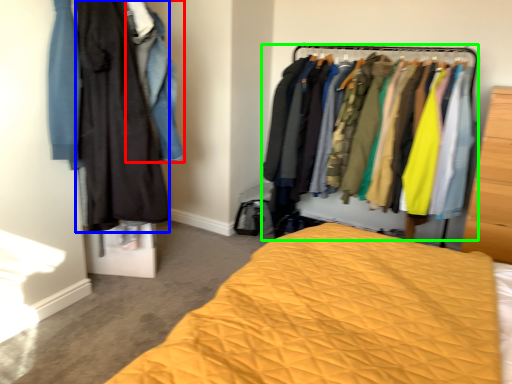
Question: Which is farther away from clothing (highlighted by a red box)? clothing (highlighted by a blue box) or closet (highlighted by a green box)?

Choices:
 (A) clothing
 (B) closet

Answer: (B)